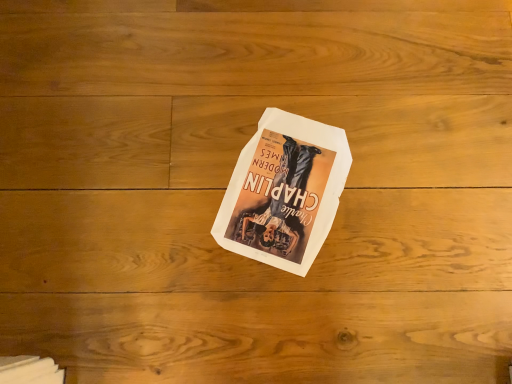
The height and width of the screenshot is (384, 512). Identify the location of vacant space to the left of white paper at center. (162, 183).